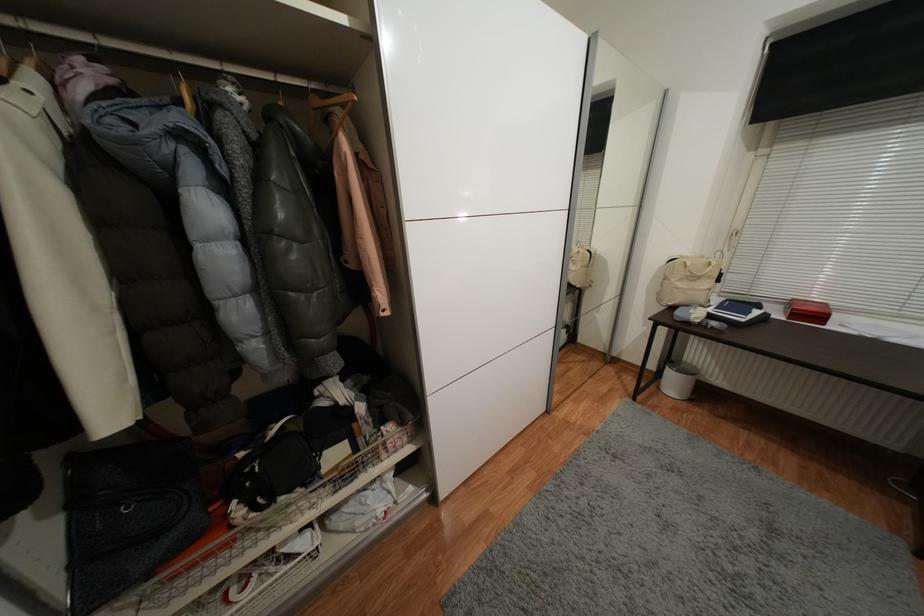
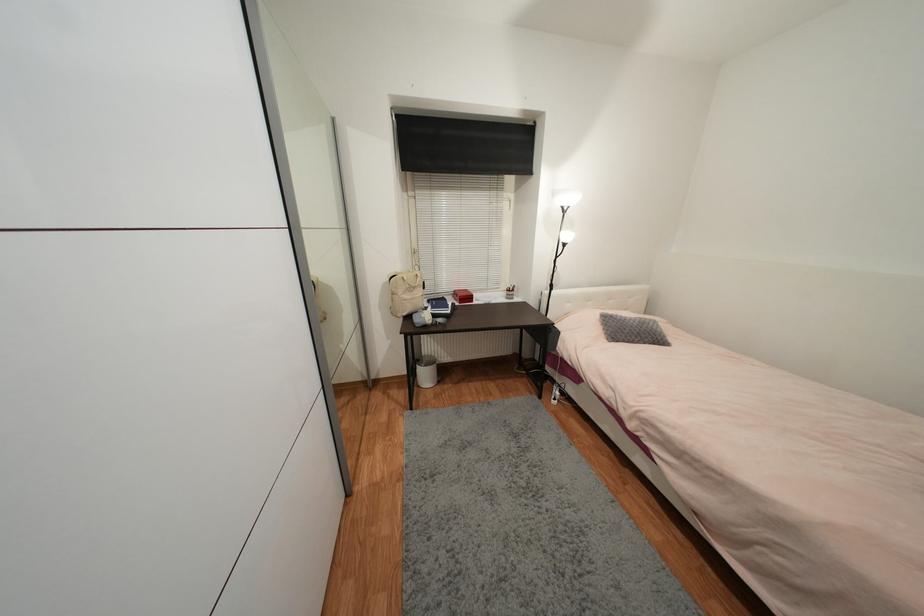
In the second image, find the point that corresponds to pixel 707 257 in the first image.

(412, 273)